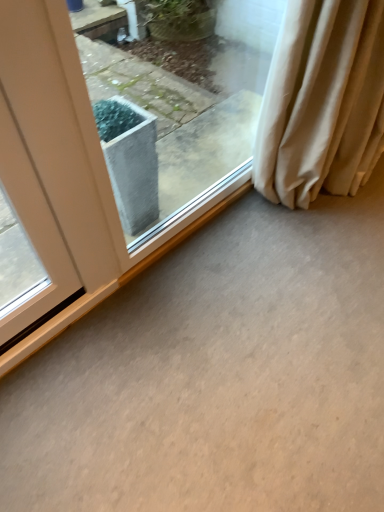
What are the coordinates of `gray concrete at center` in the screenshot? It's located at (217, 374).

In order to face transparent glass window at center, should I rotate leftwards or rightwards?

A 1.253 degree turn to the right will do.

Find the location of `gray concrete at center`. gray concrete at center is located at coordinates (217, 374).

Does gray concrete at center have a lesser height compared to beige fabric curtain at right?

Yes, gray concrete at center is shorter than beige fabric curtain at right.

From a real-world perspective, does gray concrete at center sit lower than beige fabric curtain at right?

Yes, from a real-world perspective, gray concrete at center is beneath beige fabric curtain at right.

Is gray concrete at center with beige fabric curtain at right?

They are not placed beside each other.

Is the position of gray concrete at center less distant than that of beige fabric curtain at right?

Yes, the depth of gray concrete at center is less than that of beige fabric curtain at right.

Is beige fabric curtain at right taller than gray concrete at center?

Indeed, beige fabric curtain at right has a greater height compared to gray concrete at center.

Is point (368, 103) more distant than point (279, 398)?

Yes, it is.

Considering the sizes of objects beige fabric curtain at right and gray concrete at center in the image provided, who is wider, beige fabric curtain at right or gray concrete at center?

Wider between the two is gray concrete at center.

Between beige fabric curtain at right and gray concrete at center, which one appears on the right side from the viewer's perspective?

Positioned to the right is beige fabric curtain at right.

Identify the location of window in front of the beige fabric curtain at right. (182, 109).

Considering the points (201, 185) and (275, 128), which point is in front, point (201, 185) or point (275, 128)?

The point (275, 128) is in front.

Consider the image. In terms of size, does transparent glass window at center appear bigger or smaller than beige fabric curtain at right?

transparent glass window at center is smaller than beige fabric curtain at right.

Does transparent glass window at center appear on the left side of beige fabric curtain at right?

Yes, transparent glass window at center is to the left of beige fabric curtain at right.

Is transparent glass window at center positioned far away from gray concrete at center?

No, transparent glass window at center is not far away from gray concrete at center.

Is transparent glass window at center inside the boundaries of gray concrete at center, or outside?

transparent glass window at center lies outside gray concrete at center.

Which object is closer to the camera taking this photo, transparent glass window at center or gray concrete at center?

Positioned in front is gray concrete at center.

Which object is positioned more to the right, beige fabric curtain at right or transparent glass window at center?

Positioned to the right is beige fabric curtain at right.

Is transparent glass window at center located within beige fabric curtain at right?

Actually, transparent glass window at center is outside beige fabric curtain at right.

Is point (273, 192) more distant than point (252, 82)?

Yes, it is.

Which is correct: gray concrete at center is inside transparent glass window at center, or outside of it?

gray concrete at center is not inside transparent glass window at center, it's outside.

Find the location of a particular element. Image resolution: width=384 pixels, height=512 pixels. window above the gray concrete at center (from a real-world perspective) is located at coordinates (182, 109).

Is gray concrete at center shorter than transparent glass window at center?

Indeed, gray concrete at center has a lesser height compared to transparent glass window at center.

Considering the points (290, 358) and (247, 98), which point is in front, point (290, 358) or point (247, 98)?

The point (290, 358) is closer.

Identify the location of curtain located behind the gray concrete at center. This screenshot has width=384, height=512. click(322, 102).

The width and height of the screenshot is (384, 512). In the image, there is a beige fabric curtain at right. In order to click on concrete below it (from the image's perspective) in this screenshot , I will do `click(217, 374)`.

From the image, which object appears to be farther from beige fabric curtain at right, transparent glass window at center or gray concrete at center?

gray concrete at center lies further to beige fabric curtain at right than the other object.

Based on their spatial positions, is gray concrete at center or beige fabric curtain at right closer to transparent glass window at center?

beige fabric curtain at right is closer to transparent glass window at center.

Considering their positions, is beige fabric curtain at right positioned further to gray concrete at center than transparent glass window at center?

transparent glass window at center is further to gray concrete at center.

Which object lies nearer to the anchor point transparent glass window at center, beige fabric curtain at right or gray concrete at center?

beige fabric curtain at right is positioned closer to the anchor transparent glass window at center.

Looking at the image, which one is located closer to beige fabric curtain at right, gray concrete at center or transparent glass window at center?

Among the two, transparent glass window at center is located nearer to beige fabric curtain at right.

From the image, which object appears to be nearer to gray concrete at center, transparent glass window at center or beige fabric curtain at right?

beige fabric curtain at right is positioned closer to the anchor gray concrete at center.

I want to click on window between beige fabric curtain at right and gray concrete at center from top to bottom, so click(x=182, y=109).